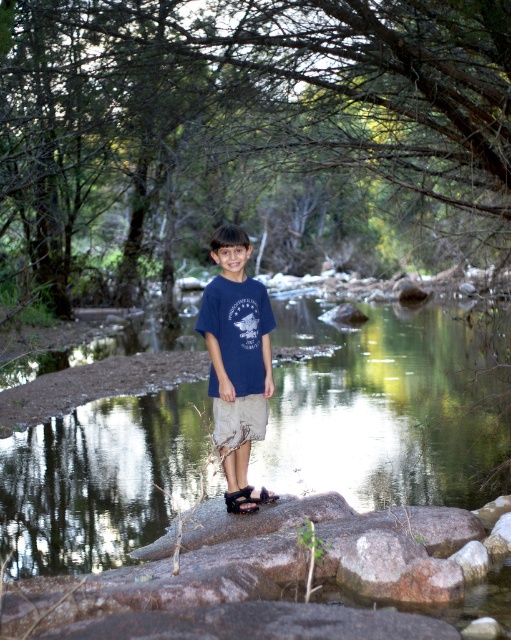
Is clear water at rock center below blue cotton shirt at center?

Correct, clear water at rock center is located below blue cotton shirt at center.

Is clear water at rock center wider than blue cotton shirt at center?

Yes, clear water at rock center is wider than blue cotton shirt at center.

This screenshot has width=511, height=640. I want to click on clear water at rock center, so click(390, 406).

Find the location of `clear water at rock center`. clear water at rock center is located at coordinates (390, 406).

Can you confirm if clear water at rock center is positioned to the left of brown leather sandal at center?

Incorrect, clear water at rock center is not on the left side of brown leather sandal at center.

Does clear water at rock center appear over brown leather sandal at center?

Correct, clear water at rock center is located above brown leather sandal at center.

At what (x,y) coordinates should I click in order to perform the action: click on clear water at rock center. Please return your answer as a coordinate pair (x, y). Looking at the image, I should click on (390, 406).

Image resolution: width=511 pixels, height=640 pixels. I want to click on clear water at rock center, so click(390, 406).

In the scene shown: Is the position of blue cotton shirt at center less distant than that of black suede sandal at center?

Yes, blue cotton shirt at center is closer to the viewer.

Locate an element on the screen. The height and width of the screenshot is (640, 511). blue cotton shirt at center is located at coordinates (237, 352).